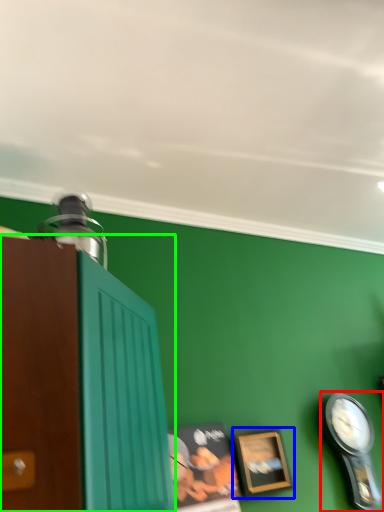
Question: Estimate the real-world distances between objects in this image. Which object is closer to clock (highlighted by a red box), picture frame (highlighted by a blue box) or cabinetry (highlighted by a green box)?

Choices:
 (A) picture frame
 (B) cabinetry

Answer: (A)